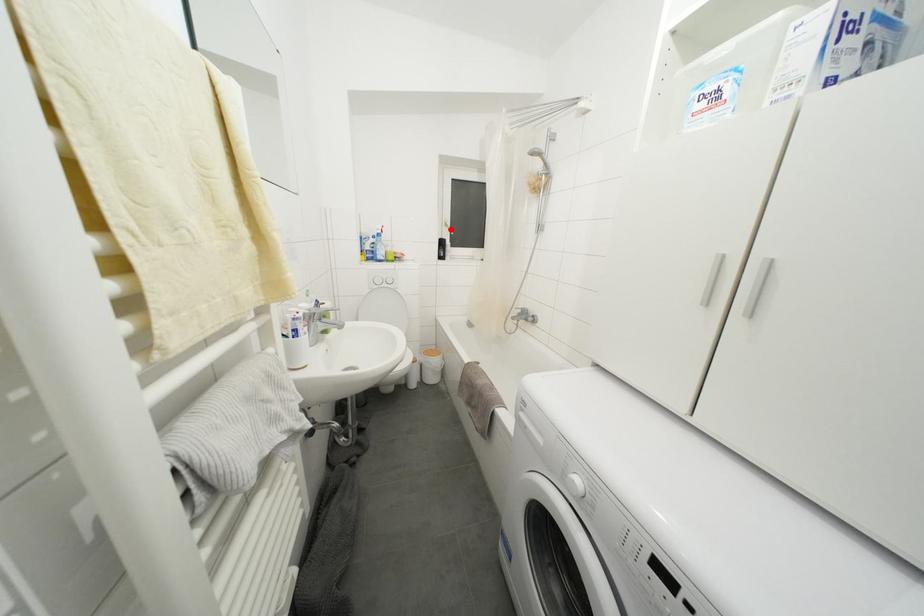
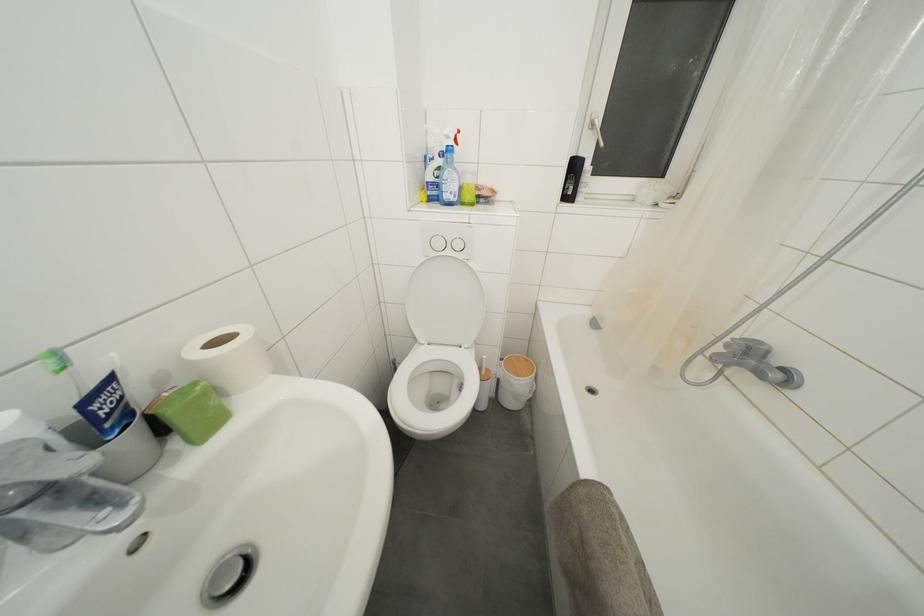
Where in the second image is the point corresponding to the highlighted location from the first image?

(597, 131)